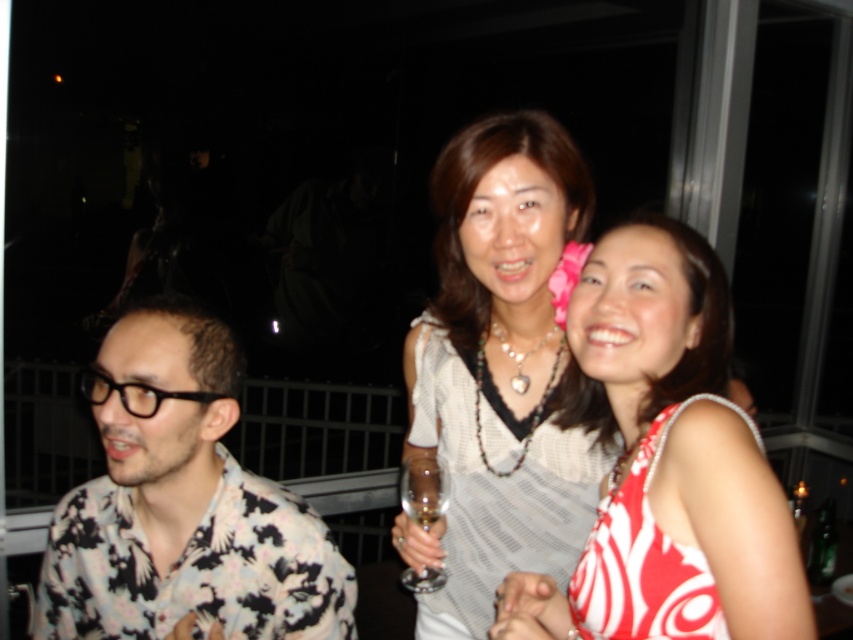
You are a photographer at the event and want to capture a clear shot of the clear glass wine at center. However, the red and white printed dress at center is blocking your view. Can you adjust your position to take the photo without moving the subjects?

The red and white printed dress at center is in front of the clear glass wine at center, so you can move your camera position slightly to the side to avoid the dress blocking the view of the clear glass wine at center.

You are a photographer trying to focus on the red and white printed dress at center. What are the coordinates where you should aim your camera?

The red and white printed dress at center is located at coordinates point (668, 464). Aim your camera there to focus on it.